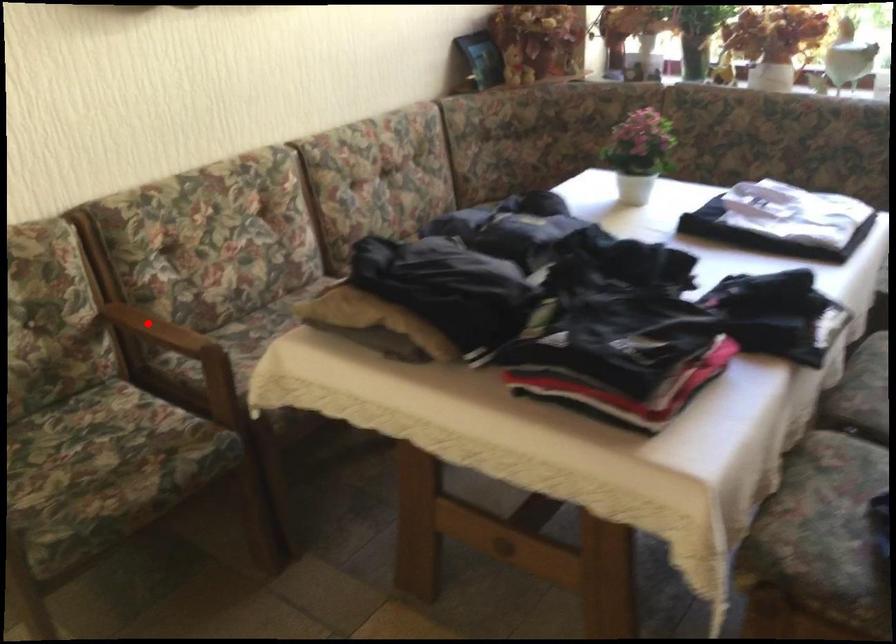
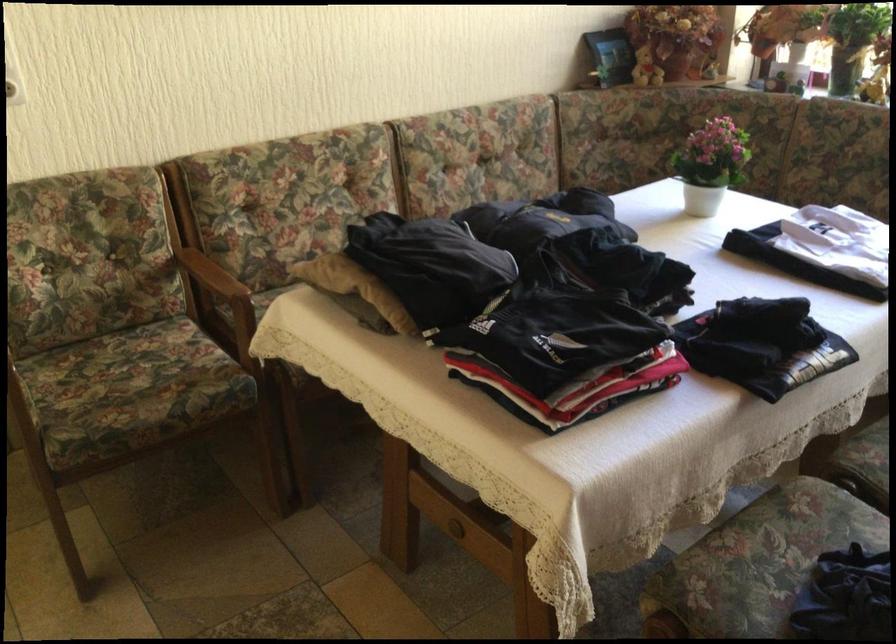
Question: A red point is marked in image1. In image2, is the corresponding 3D point closer to the camera or farther? Reply with the corresponding letter.

Choices:
 (A) The corresponding 3D point is closer.
 (B) The corresponding 3D point is farther.

Answer: (B)